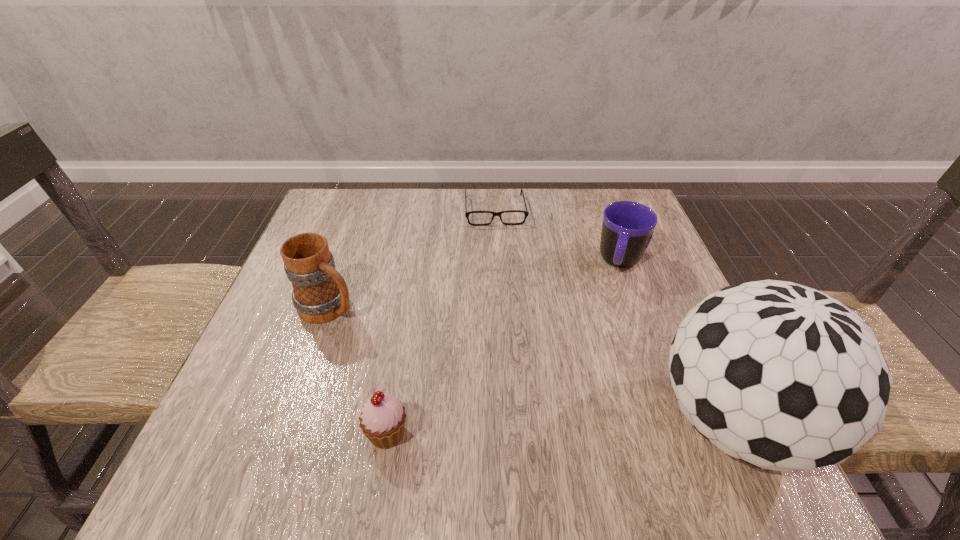
You are a GUI agent. You are given a task and a screenshot of the screen. Output one action in this format:
    pyautogui.click(x=<x>, y=<y>)
    Task: Click on the cupcake at the near edge
    The image size is (960, 540).
    Given the screenshot: What is the action you would take?
    pyautogui.click(x=382, y=420)

Locate an element on the screen. The width and height of the screenshot is (960, 540). soccer ball that is at the near edge is located at coordinates (781, 376).

Where is `object at the left edge`? object at the left edge is located at coordinates (320, 294).

In order to click on soccer ball that is at the right edge in this screenshot , I will do `click(781, 376)`.

You are a GUI agent. You are given a task and a screenshot of the screen. Output one action in this format:
    pyautogui.click(x=<x>, y=<y>)
    Task: Click on the mug present at the right edge
    
    Given the screenshot: What is the action you would take?
    pyautogui.click(x=627, y=229)

Where is `object at the near right corner`? object at the near right corner is located at coordinates (781, 376).

Where is `vacant space at the far edge`? vacant space at the far edge is located at coordinates (444, 230).

In order to click on vacant space at the near edge of the desktop in this screenshot , I will do `click(533, 388)`.

The image size is (960, 540). Find the location of `free space at the left edge`. free space at the left edge is located at coordinates (309, 358).

This screenshot has width=960, height=540. I want to click on vacant space at the right edge, so click(640, 272).